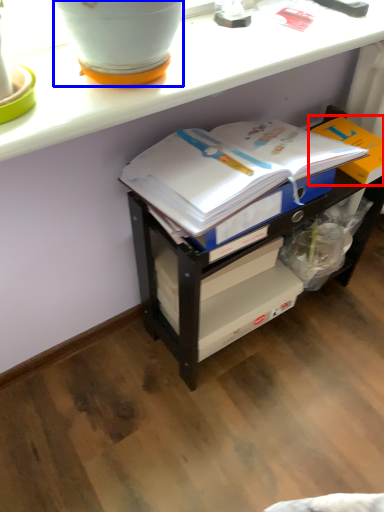
Question: Which object appears closest to the camera in this image, cardboard box (highlighted by a red box) or flowerpot (highlighted by a blue box)?

Choices:
 (A) cardboard box
 (B) flowerpot

Answer: (B)